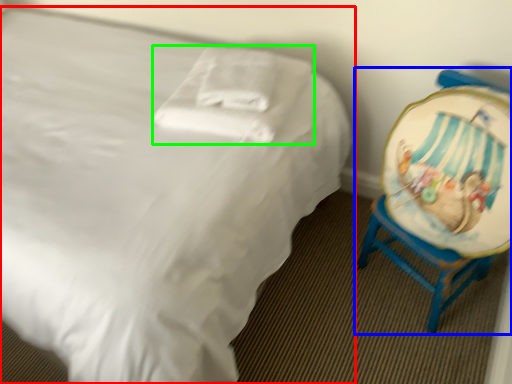
Question: Based on their relative distances, which object is farther from bed (highlighted by a red box)? Choose from chair (highlighted by a blue box) and pillow (highlighted by a green box).

Choices:
 (A) chair
 (B) pillow

Answer: (A)